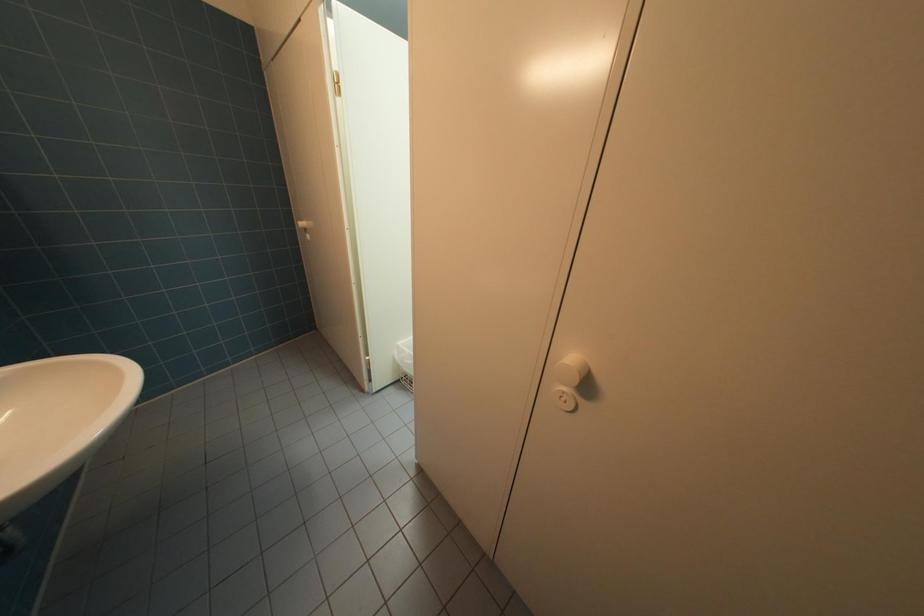
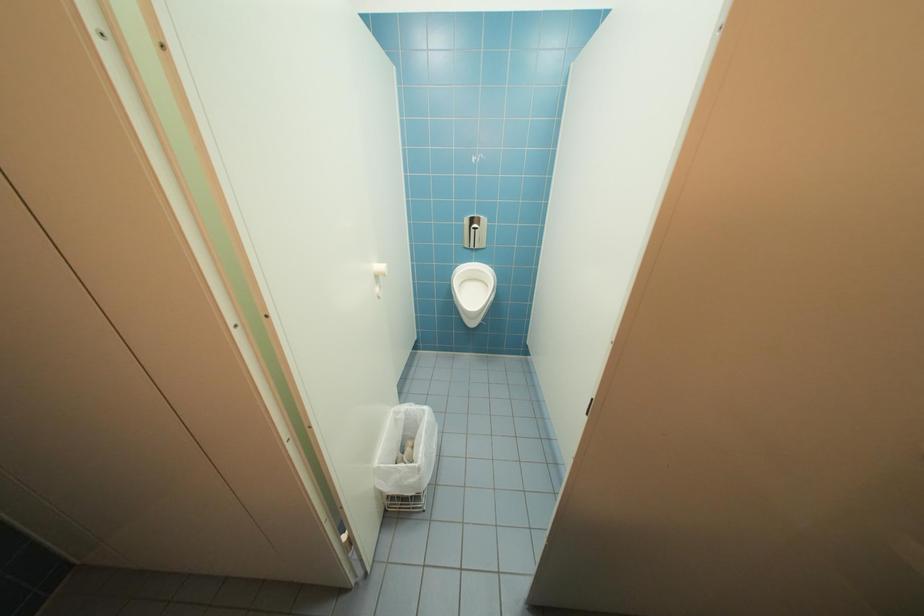
Question: The camera is either moving clockwise (left) or counter-clockwise (right) around the object. The first image is from the beginning of the video and the second image is from the end. Is the camera moving left or right when shooting the video?

Choices:
 (A) Left
 (B) Right

Answer: (A)